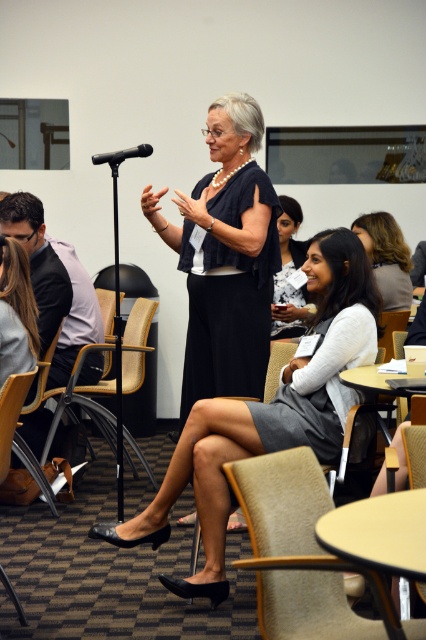
You are standing at the point marked as point (x=362, y=305). You want to walk to the front of the room to ask a question. How far will you have to walk?

You will have to walk 3.12 meters to reach the front of the room from point (x=362, y=305).

What is the position of the gray fabric dress at center relative to the black plastic microphone at upper left?

The gray fabric dress at center is positioned to the right of the black plastic microphone at upper left.

You are an event planner trying to locate the gray fabric skirt at center in the image. What are the coordinates where you can find it?

The gray fabric skirt at center is located at coordinates point [268,412].